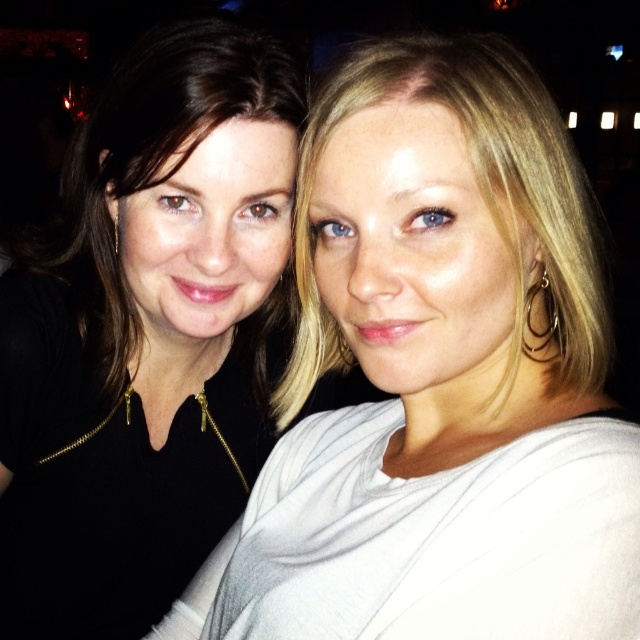
Does matte black top at left have a larger size compared to white matte shirt at upper right?

Indeed, matte black top at left has a larger size compared to white matte shirt at upper right.

Does matte black top at left have a lesser height compared to white matte shirt at upper right?

Correct, matte black top at left is not as tall as white matte shirt at upper right.

What are the coordinates of `matte black top at left` in the screenshot? It's located at (438, 378).

Find the location of a particular element. matte black top at left is located at coordinates (438, 378).

Can you confirm if white matte shirt at upper right is positioned to the left of matte black top at upper left?

Correct, you'll find white matte shirt at upper right to the left of matte black top at upper left.

Does point (289, 168) come closer to viewer compared to point (557, 292)?

No, (289, 168) is further to viewer.

Where is `white matte shirt at upper right`? This screenshot has height=640, width=640. white matte shirt at upper right is located at coordinates (147, 333).

Does matte black top at left appear on the right side of matte black top at upper left?

In fact, matte black top at left is to the left of matte black top at upper left.

Who is more forward, (529, 170) or (524, 157)?

Positioned in front is point (524, 157).

Is point (333, 125) farther from viewer compared to point (592, 372)?

That is False.

Where is `matte black top at left`? The width and height of the screenshot is (640, 640). matte black top at left is located at coordinates (438, 378).